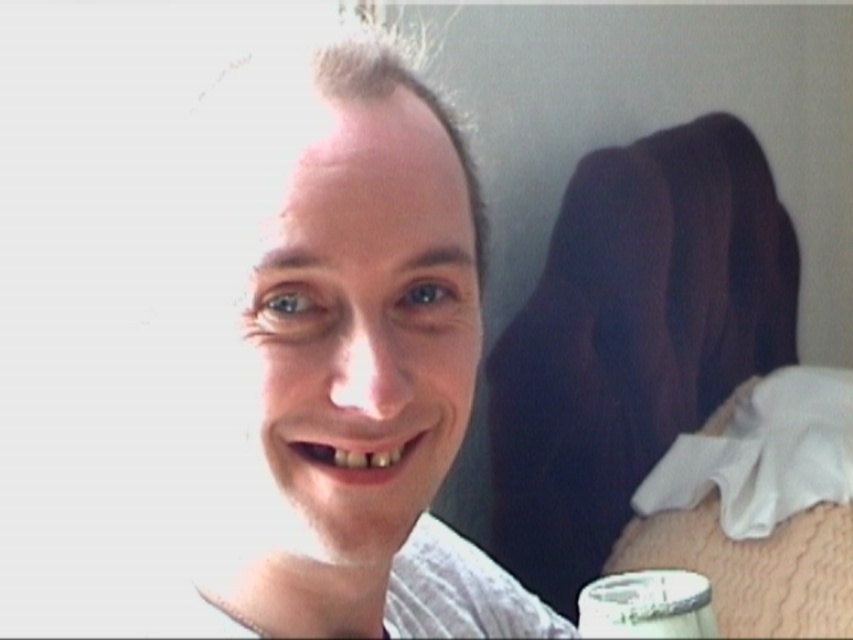
Looking at the image, which object is larger between the white textured shirt at center and the metallic silver cup at lower right?

The white textured shirt at center is bigger than the metallic silver cup at lower right.

From the picture: You are standing in front of the image and want to move from the point at coordinate (x=242, y=369) to the point at coordinate (x=642, y=630). Which direction should you move to reach the second point?

To move from point (x=242, y=369) to point (x=642, y=630), you should move diagonally towards the bottom right since point (x=642, y=630) is located further to the right and lower than the first point.

You are a photographer trying to focus on the white textured shirt at center. What are the exact coordinates of the shirt in the image?

The white textured shirt at center is located at the 2D coordinates of point (x=352, y=355).